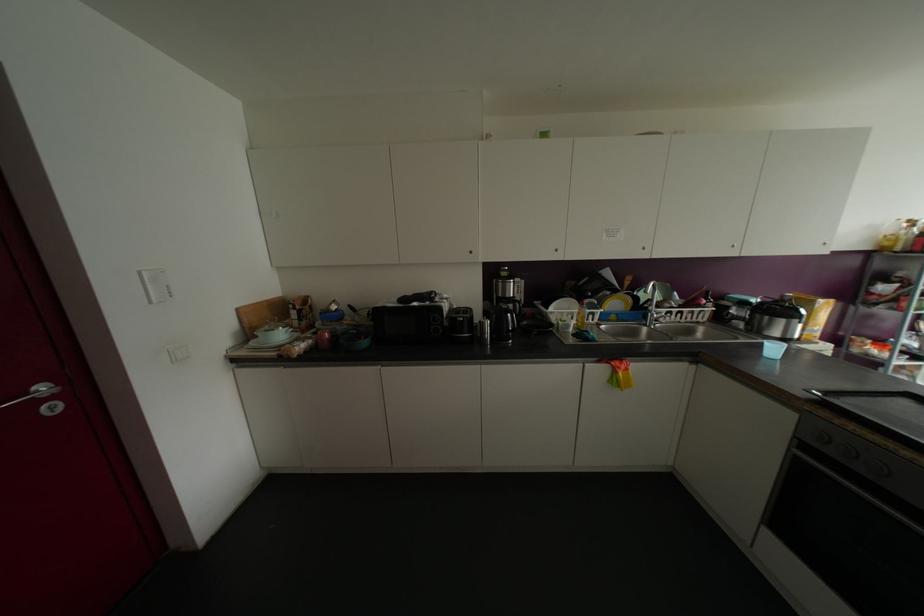
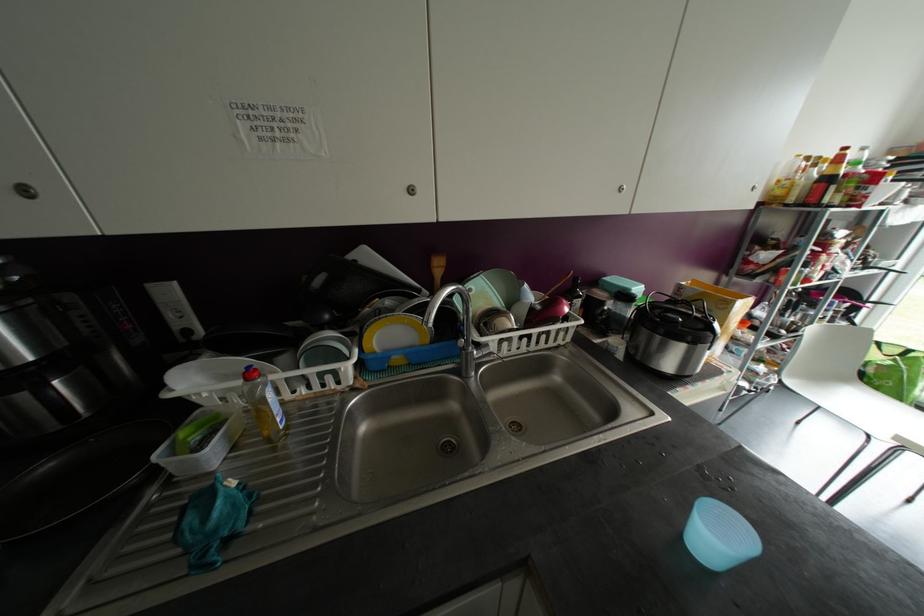
Where in the second image is the point corresponding to point (626, 280) from the first image?

(438, 265)